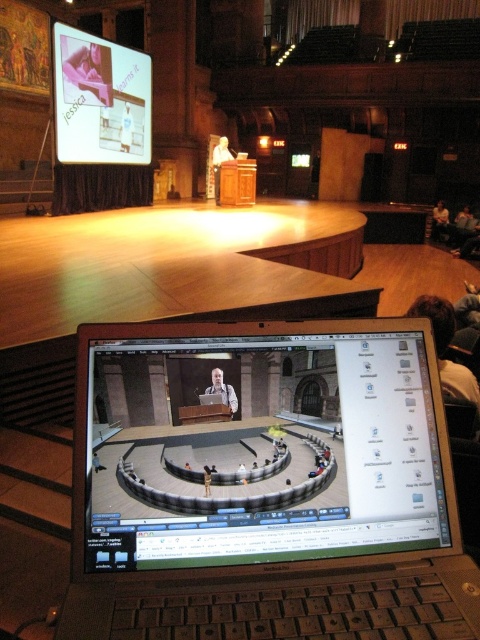
You are attending a virtual meeting from your laptop and see the white shirt at center and the dark brown leather jacket at upper right on the screen. Which object is positioned closer to you in the image?

The white shirt at center is closer to the viewer than the dark brown leather jacket at upper right.

You are sitting in the audience of this lecture hall and notice two points marked on the stage. The first point is at coordinates point (148,136) and the second is at point (444,307). Which point is closer to you?

Point (148,136) is further to the camera than point (444,307), so the point closer to you is point (444,307).

You are a student attending a virtual lecture. You see the silver metallic laptop at center and the smooth skin person at center on the screen. Which object is wider?

The silver metallic laptop at center is wider than the smooth skin person at center.